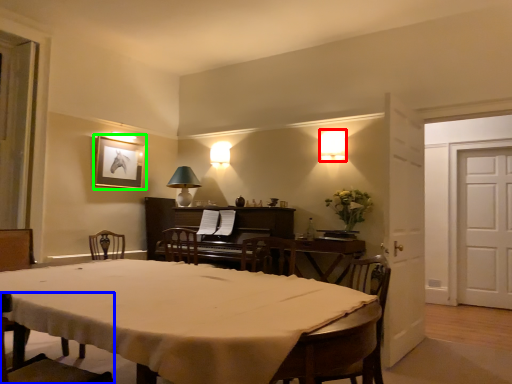
Question: Which object is the farthest from lamp (highlighted by a red box)? Choose among these: chair (highlighted by a blue box) or picture frame (highlighted by a green box).

Choices:
 (A) chair
 (B) picture frame

Answer: (A)